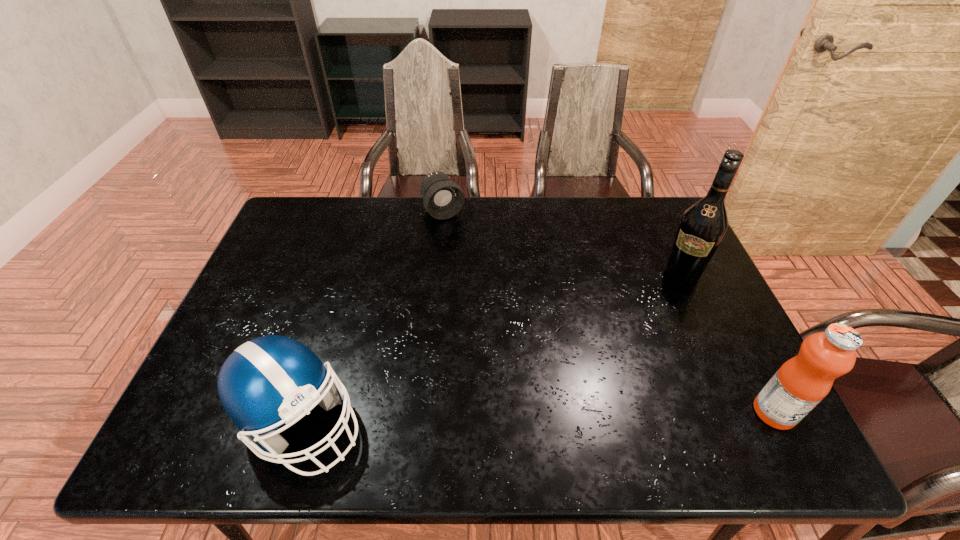
At what (x,y) coordinates should I click in order to perform the action: click on the leftmost object. Please return your answer as a coordinate pair (x, y). Image resolution: width=960 pixels, height=540 pixels. Looking at the image, I should click on (272, 380).

This screenshot has width=960, height=540. In order to click on football helmet in this screenshot , I will do tap(272, 380).

Find the location of a particular element. fruit juice is located at coordinates (802, 382).

The image size is (960, 540). I want to click on the third object from right to left, so click(x=443, y=198).

Where is `telephoto lens`? The width and height of the screenshot is (960, 540). telephoto lens is located at coordinates (443, 198).

This screenshot has height=540, width=960. In order to click on the tallest object in this screenshot , I will do `click(702, 228)`.

This screenshot has height=540, width=960. What are the coordinates of `wine bottle` in the screenshot? It's located at (702, 228).

Identify the location of vacant space located at the front element of the farthest object. (487, 283).

Identify the location of vacant region located 0.390m at the front element of the farthest object. This screenshot has width=960, height=540. (500, 305).

At what (x,y) coordinates should I click in order to perform the action: click on vacant position located at the front element of the farthest object. Please return your answer as a coordinate pair (x, y). Looking at the image, I should click on (494, 294).